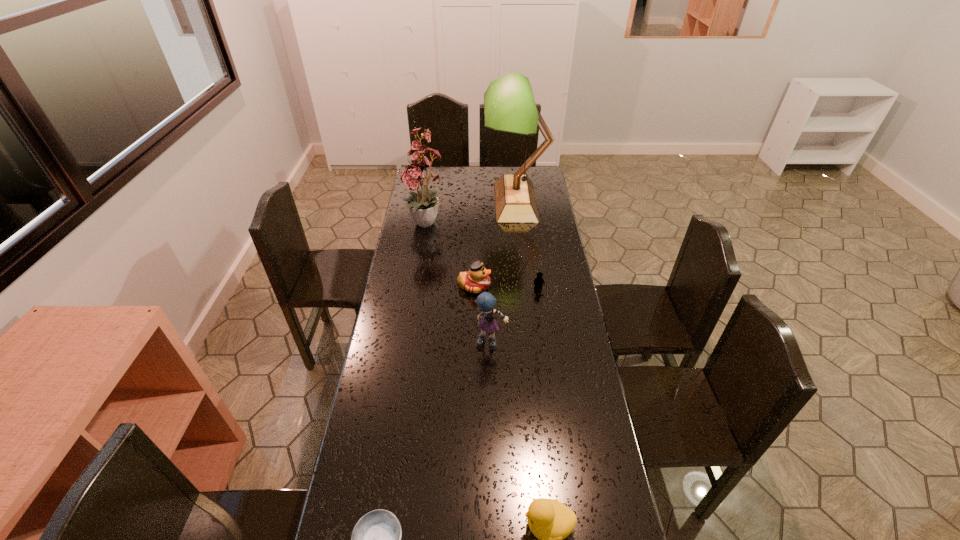
Locate an element on the screen. This screenshot has width=960, height=540. vacant area at the right edge is located at coordinates (538, 201).

Find the location of a particular element. This screenshot has width=960, height=540. free area in between the Lego and the farther duck is located at coordinates (506, 287).

Where is `vacant area between the tallest object and the farther duck`? The image size is (960, 540). vacant area between the tallest object and the farther duck is located at coordinates (495, 244).

The height and width of the screenshot is (540, 960). Identify the location of free area in between the tallest object and the left duck. (495, 244).

In order to click on empty location between the tallest object and the flower arrangement in this screenshot , I will do pos(471,214).

This screenshot has width=960, height=540. In order to click on vacant space in between the table lamp and the farther duck in this screenshot , I will do `click(495, 244)`.

Where is `object identified as the fourth closest to the right duck`? The image size is (960, 540). object identified as the fourth closest to the right duck is located at coordinates (538, 281).

I want to click on the third closest object to the right duck, so click(476, 280).